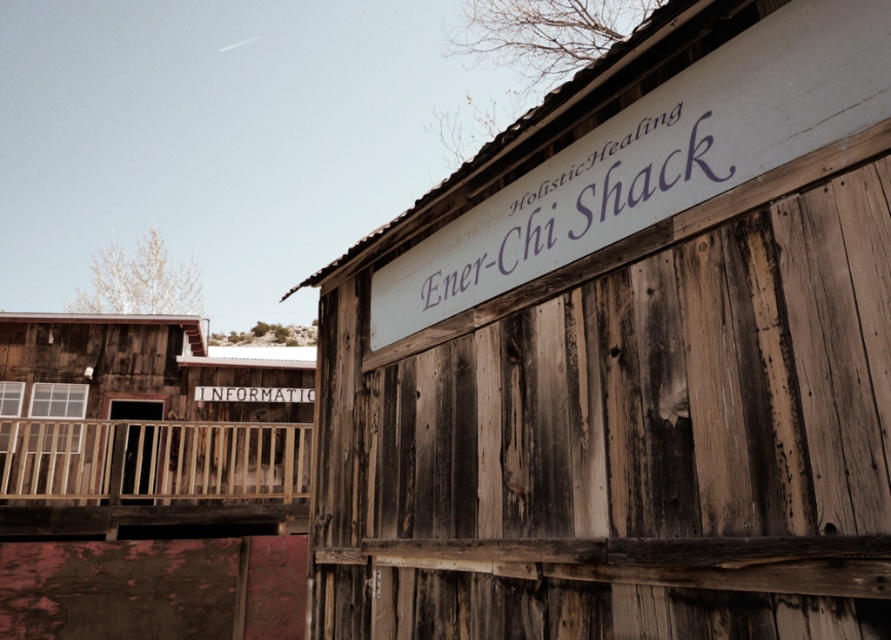
Question: Which object is the closest to the weathered wood barn at upper right?

Choices:
 (A) wooden at left
 (B) weathered wood information sign at left
 (C) purple painted wood sign at upper center

Answer: (C)

Question: Which of the following is the closest to the observer?

Choices:
 (A) weathered wood barn at upper right
 (B) weathered wood information sign at left
 (C) white wooden sign at center
 (D) purple painted wood sign at upper center

Answer: (A)

Question: Among these points, which one is nearest to the camera?

Choices:
 (A) (634, 170)
 (B) (12, 420)
 (C) (583, 410)
 (D) (203, 390)

Answer: (A)

Question: Is weathered wood information sign at left to the right of purple painted wood sign at upper center from the viewer's perspective?

Choices:
 (A) no
 (B) yes

Answer: (A)

Question: In this image, where is weathered wood barn at upper right located relative to white wooden sign at center?

Choices:
 (A) below
 (B) above

Answer: (B)

Question: Does wooden at left lie behind white wooden sign at center?

Choices:
 (A) no
 (B) yes

Answer: (A)